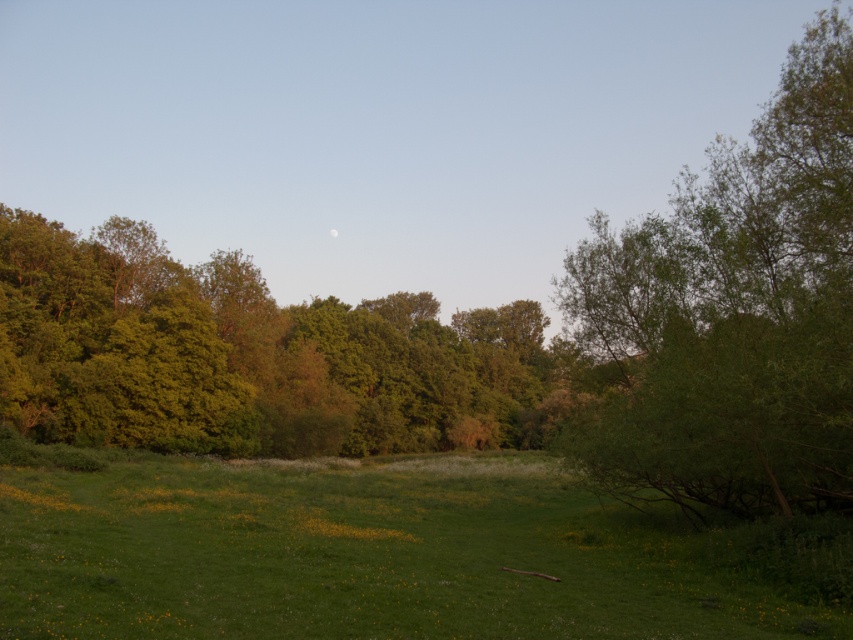
Which of these two, green grassy field at center or green leafy tree at right, stands shorter?

green grassy field at center

Is green grassy field at center in front of green leafy tree at right?

Yes, green grassy field at center is closer to the viewer.

You are a GUI agent. You are given a task and a screenshot of the screen. Output one action in this format:
    pyautogui.click(x=<x>, y=<y>)
    Task: Click on the green grassy field at center
    The image size is (853, 640).
    Given the screenshot: What is the action you would take?
    point(366,556)

Find the location of a particular element. The width and height of the screenshot is (853, 640). green grassy field at center is located at coordinates (366, 556).

Between green grassy field at center and green leafy tree at center, which one is positioned lower?

green grassy field at center

Can you confirm if green grassy field at center is taller than green leafy tree at center?

No.

Does point (339, 604) come closer to viewer compared to point (271, 438)?

Yes, point (339, 604) is in front of point (271, 438).

I want to click on green grassy field at center, so click(366, 556).

Can you confirm if green leafy tree at right is thinner than green leafy tree at center?

Yes, green leafy tree at right is thinner than green leafy tree at center.

Which is in front, point (840, 280) or point (132, 332)?

Positioned in front is point (840, 280).

Is point (706, 312) in front of point (252, 273)?

Yes, point (706, 312) is in front of point (252, 273).

Identify the location of green leafy tree at right. (732, 312).